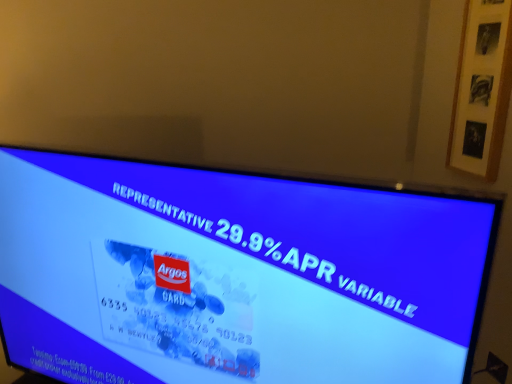
Measure the distance between blue glossy screen at center and camera.

blue glossy screen at center and camera are 61.14 centimeters apart.

In order to click on blue glossy screen at center in this screenshot , I will do `click(234, 275)`.

Describe the element at coordinates (234, 275) in the screenshot. I see `blue glossy screen at center` at that location.

Locate an element on the screen. This screenshot has height=384, width=512. blue glossy screen at center is located at coordinates (234, 275).